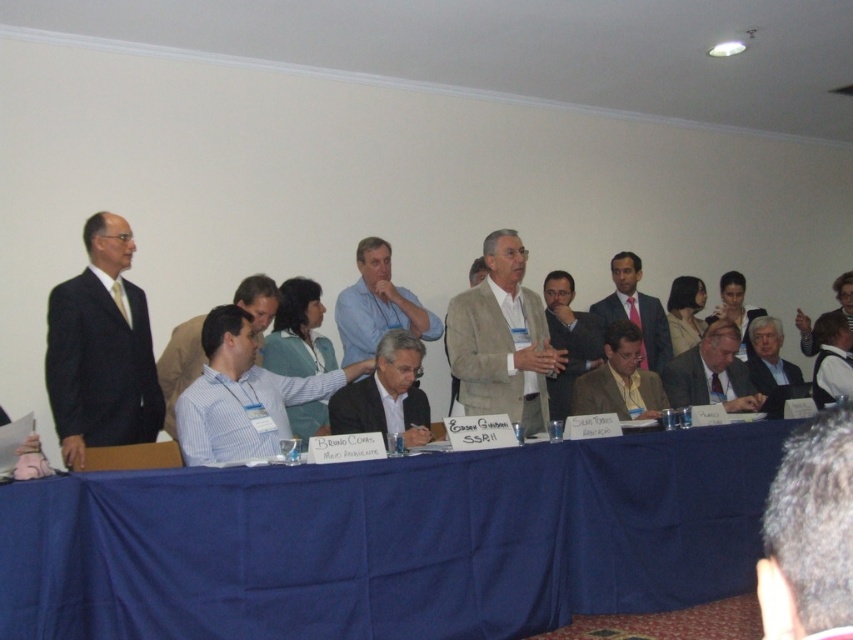
Question: Where is dark brown hair at upper right located in relation to matte brown suit at center in the image?

Choices:
 (A) left
 (B) right

Answer: (A)

Question: Is blue fabric table at center positioned before matte white shirt at center?

Choices:
 (A) yes
 (B) no

Answer: (A)

Question: Which object is farther from the camera taking this photo?

Choices:
 (A) blue shirt at center
 (B) beige fabric suit at center
 (C) matte gray suit at center
 (D) matte brown suit at center

Answer: (C)

Question: Which object is closer to the camera taking this photo?

Choices:
 (A) blue fabric table at center
 (B) matte pink tie at center

Answer: (A)

Question: Which point is closer to the camera?

Choices:
 (A) matte white shirt at center
 (B) light brown suit at center
 (C) beige fabric suit at center
 (D) dark brown hair at upper right

Answer: (D)

Question: Does matte black suit at left have a lesser width compared to light brown suit at center?

Choices:
 (A) yes
 (B) no

Answer: (A)